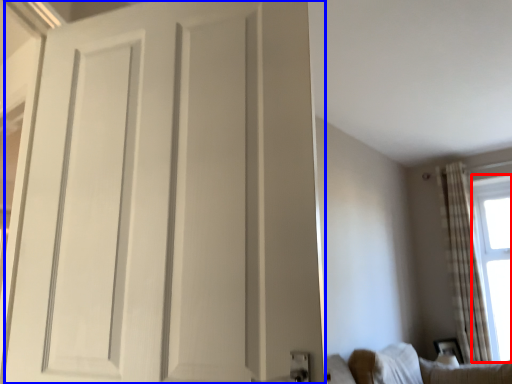
Question: Which object is further to the camera taking this photo, window screen (highlighted by a red box) or door (highlighted by a blue box)?

Choices:
 (A) window screen
 (B) door

Answer: (A)